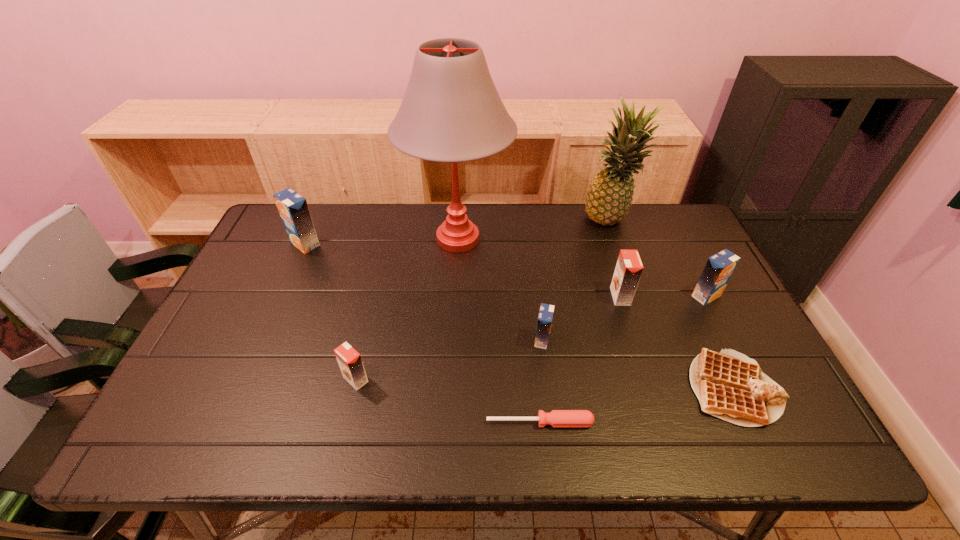
This screenshot has height=540, width=960. In order to click on light table lamp in this screenshot , I will do `click(451, 111)`.

This screenshot has height=540, width=960. I want to click on table lamp, so click(x=451, y=111).

The width and height of the screenshot is (960, 540). Find the location of `the second tallest object`. the second tallest object is located at coordinates (609, 195).

Where is `green pineapple`? The width and height of the screenshot is (960, 540). green pineapple is located at coordinates (609, 195).

You are a GUI agent. You are given a task and a screenshot of the screen. Output one action in this format:
    pyautogui.click(x=<x>, y=<y>)
    Task: Click on the leftmost blue orange_juice
    
    Given the screenshot: What is the action you would take?
    coord(293,209)

Find the location of a particular element. This screenshot has width=960, height=540. the leftmost object is located at coordinates (293, 209).

This screenshot has width=960, height=540. Identify the location of the farther orange orange juice. (629, 267).

At what (x,y) coordinates should I click in order to perform the action: click on the bigger orange orange juice. Please return your answer as a coordinate pair (x, y). Image resolution: width=960 pixels, height=540 pixels. Looking at the image, I should click on (629, 267).

In order to click on the second smallest blue orange_juice in this screenshot , I will do `click(719, 268)`.

Identify the location of the second farthest blue orange_juice. (719, 268).